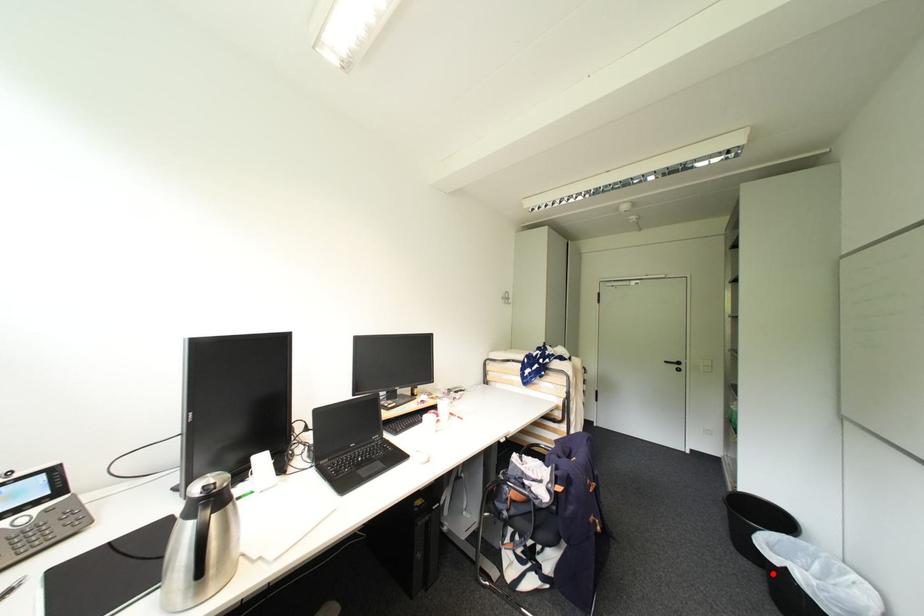
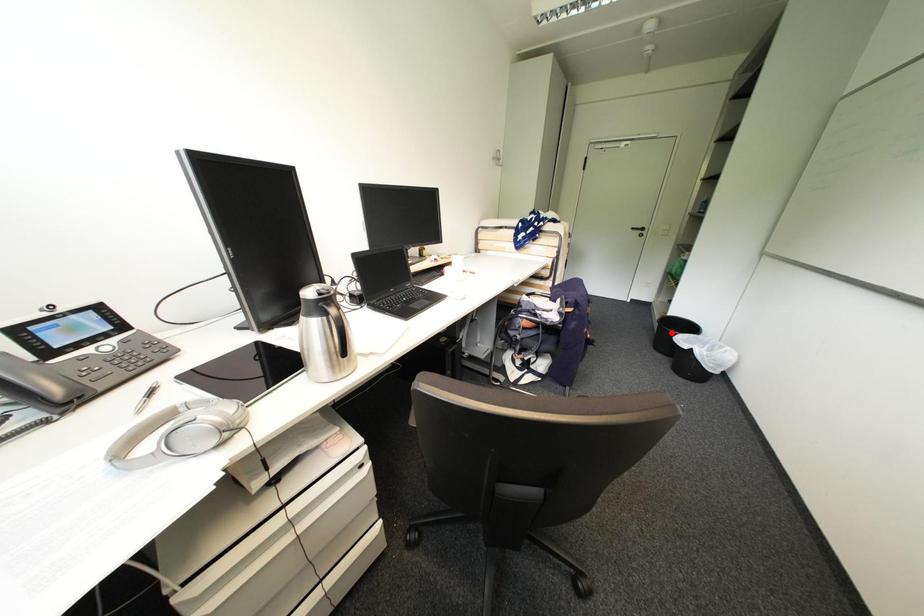
I am providing you with two images of the same scene from different viewpoints. A red point is marked on the first image and another point is marked on the second image. Do the highlighted points in image1 and image2 indicate the same real-world spot?

No